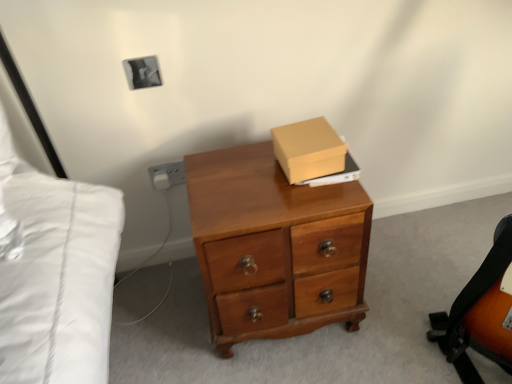
Locate an element on the screen. free space on the front side of matte cardboard box at upper center is located at coordinates (297, 196).